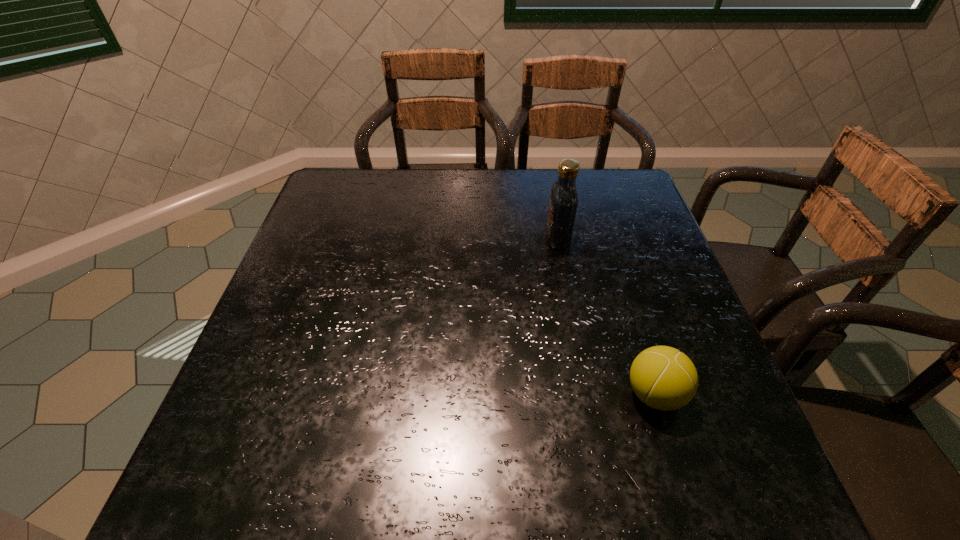
Locate an element on the screen. The image size is (960, 540). free point that satisfies the following two spatial constraints: 1. on the front-facing side of the right object; 2. on the right side of the vodka is located at coordinates (588, 394).

The height and width of the screenshot is (540, 960). Identify the location of free space that satisfies the following two spatial constraints: 1. on the front-facing side of the tennis ball; 2. on the left side of the taller object. (588, 394).

In order to click on free region that satisfies the following two spatial constraints: 1. on the front-facing side of the tennis ball; 2. on the right side of the farther object in this screenshot , I will do `click(588, 394)`.

Image resolution: width=960 pixels, height=540 pixels. What are the coordinates of `vacant space that satisfies the following two spatial constraints: 1. on the back side of the tennis ball; 2. on the front-facing side of the taller object` in the screenshot? It's located at (606, 238).

The width and height of the screenshot is (960, 540). I want to click on free space that satisfies the following two spatial constraints: 1. on the back side of the nearer object; 2. on the front-facing side of the farther object, so click(606, 238).

Identify the location of free space that satisfies the following two spatial constraints: 1. on the front-facing side of the right object; 2. on the left side of the vodka. (588, 394).

Where is `vacant space that satisfies the following two spatial constraints: 1. on the front-facing side of the right object; 2. on the right side of the farther object`? Image resolution: width=960 pixels, height=540 pixels. vacant space that satisfies the following two spatial constraints: 1. on the front-facing side of the right object; 2. on the right side of the farther object is located at coordinates (588, 394).

Where is `free space that satisfies the following two spatial constraints: 1. on the front-facing side of the taller object; 2. on the right side of the tennis ball`? The height and width of the screenshot is (540, 960). free space that satisfies the following two spatial constraints: 1. on the front-facing side of the taller object; 2. on the right side of the tennis ball is located at coordinates (588, 394).

Where is `vacant space that satisfies the following two spatial constraints: 1. on the front-facing side of the left object; 2. on the right side of the shorter object`? The image size is (960, 540). vacant space that satisfies the following two spatial constraints: 1. on the front-facing side of the left object; 2. on the right side of the shorter object is located at coordinates (588, 394).

Locate an element on the screen. free space that satisfies the following two spatial constraints: 1. on the front-facing side of the vodka; 2. on the left side of the shorter object is located at coordinates 588,394.